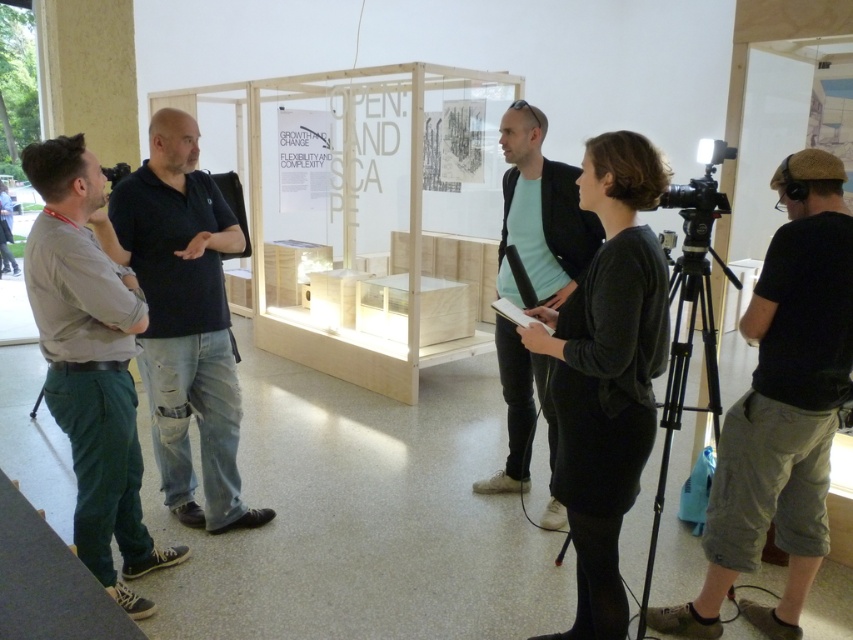
Question: Is dark blue shirt at center below light blue t-shirt at center?

Choices:
 (A) no
 (B) yes

Answer: (B)

Question: Is dark gray cotton shorts at right wider than dark blue shirt at center?

Choices:
 (A) yes
 (B) no

Answer: (A)

Question: Which is farther from the dark blue shirt at center?

Choices:
 (A) black tripod at right
 (B) green cotton pants at left
 (C) dark gray cotton shorts at right
 (D) light blue t-shirt at center

Answer: (C)

Question: Can you confirm if dark blue shirt at center is smaller than green cotton pants at left?

Choices:
 (A) no
 (B) yes

Answer: (A)

Question: Which of the following is the closest to the observer?

Choices:
 (A) (715, 433)
 (B) (212, 477)
 (C) (547, 422)
 (D) (45, 294)

Answer: (D)

Question: Which is farther from the dark gray cotton shorts at right?

Choices:
 (A) black tripod at right
 (B) light blue t-shirt at center

Answer: (B)